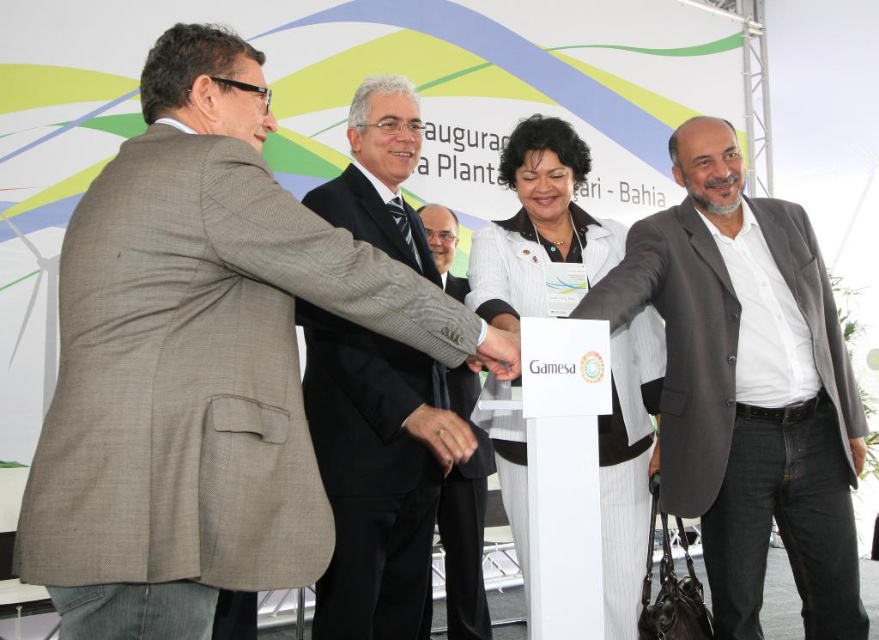
Question: Is gray wool blazer at center positioned before light gray suit at center?

Choices:
 (A) yes
 (B) no

Answer: (A)

Question: Which point is farther from the camera taking this photo?

Choices:
 (A) (447, 588)
 (B) (353, 432)
 (C) (546, 134)

Answer: (A)

Question: Estimate the real-world distances between objects in this image. Which object is closer to the black suit at center?

Choices:
 (A) gray wool blazer at center
 (B) white textured blazer at center

Answer: (B)

Question: Is gray suit at center in front of light gray suit at center?

Choices:
 (A) yes
 (B) no

Answer: (A)

Question: Can you confirm if black suit at center is wider than light gray suit at center?

Choices:
 (A) no
 (B) yes

Answer: (B)

Question: Among these objects, which one is nearest to the camera?

Choices:
 (A) gray wool blazer at center
 (B) gray suit at center

Answer: (B)